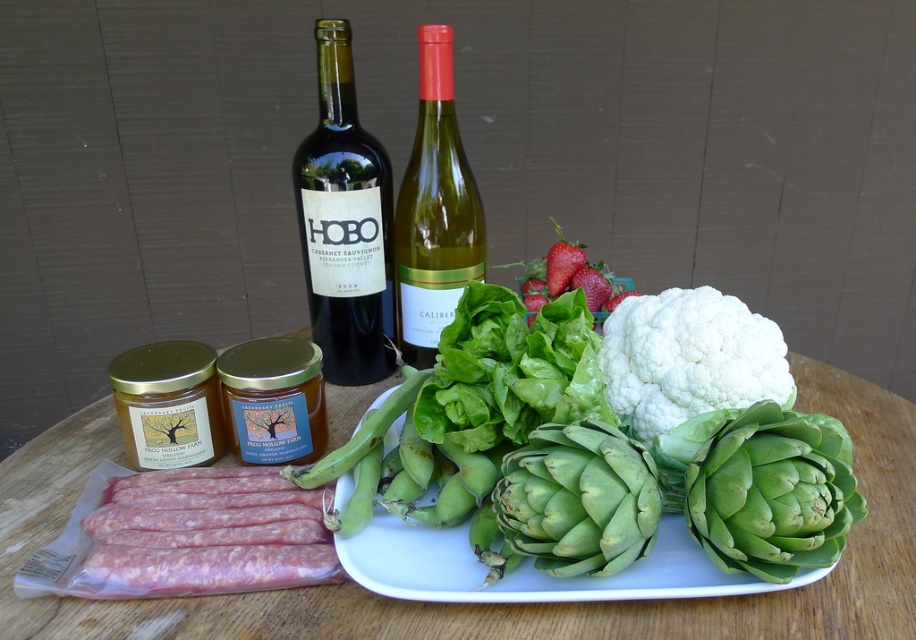
Is point (778, 556) in front of point (673, 305)?

Yes, point (778, 556) is closer to viewer.

Which of these two, green leafy artichoke at center or white fluffy cauliflower at right, stands shorter?

With less height is green leafy artichoke at center.

Between point (809, 476) and point (736, 323), which one is positioned behind?

Positioned behind is point (736, 323).

Where is `green leafy artichoke at center`? green leafy artichoke at center is located at coordinates (767, 486).

Based on the photo, who is more forward, (718, 378) or (420, 204)?

Point (718, 378)

Is white fluffy cauliflower at right positioned in front of green glass wine at center?

Yes, white fluffy cauliflower at right is in front of green glass wine at center.

Between point (713, 317) and point (424, 60), which one is positioned behind?

The point (424, 60) is more distant.

Find the location of a particular element. The image size is (916, 640). white fluffy cauliflower at right is located at coordinates (689, 356).

Is green leafy artichoke at center bigger than green glass wine at center?

No.

Between point (791, 497) and point (473, 260), which one is positioned behind?

The point (473, 260) is more distant.

Is point (775, 522) behind point (415, 140)?

No, it is not.

Identify the location of green leafy artichoke at center. (767, 486).